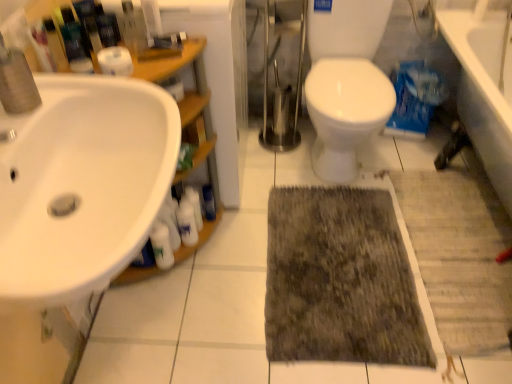
Locate an element on the screen. vacant area that lies to the right of white matte toilet paper at upper left is located at coordinates (159, 68).